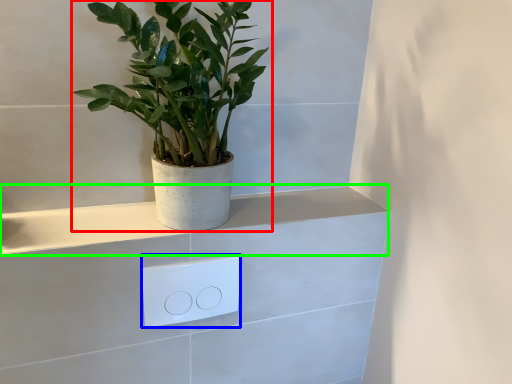
Question: Which is farther away from houseplant (highlighted by a red box)? light switch (highlighted by a blue box) or ledge (highlighted by a green box)?

Choices:
 (A) light switch
 (B) ledge

Answer: (A)